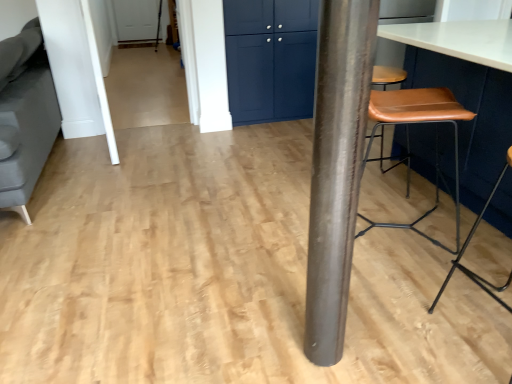
Where is `spots to the right of shiny metallic pole at center`? Image resolution: width=512 pixels, height=384 pixels. spots to the right of shiny metallic pole at center is located at coordinates (371, 345).